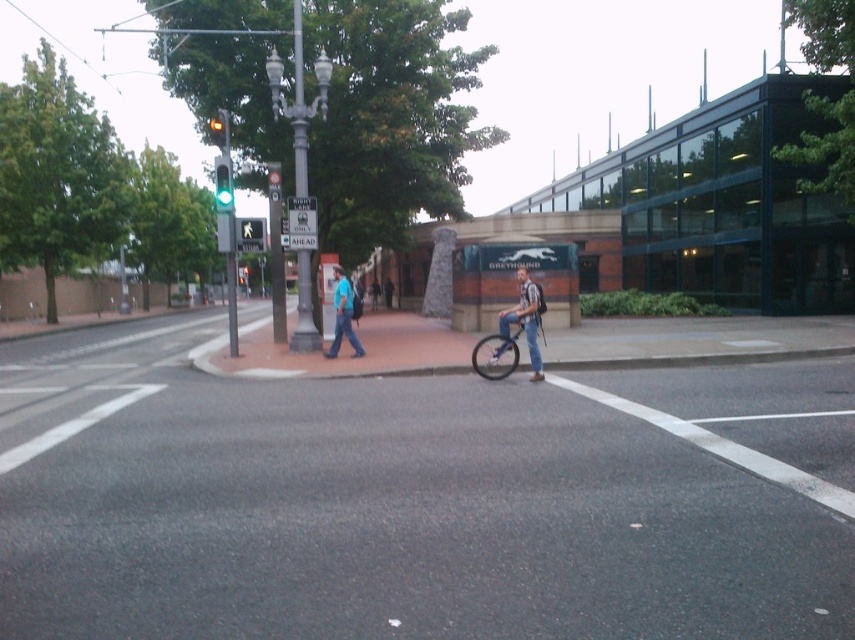
Question: In this image, where is denim jeans at center located relative to green glass traffic light at upper center?

Choices:
 (A) left
 (B) right

Answer: (B)

Question: Where is blue fabric shirt at center located in relation to black plastic pedestrian crossing at center in the image?

Choices:
 (A) left
 (B) right

Answer: (B)

Question: Among these points, which one is nearest to the camera?

Choices:
 (A) (220, 131)
 (B) (500, 328)
 (C) (345, 285)
 (D) (228, 204)

Answer: (B)

Question: Estimate the real-world distances between objects in this image. Which object is closer to the white plastic pedestrian crossing sign at center?

Choices:
 (A) green glass traffic light at upper center
 (B) green glass traffic light at upper left

Answer: (A)

Question: Can you confirm if metallic silver bicycle at center is positioned above blue fabric shirt at center?

Choices:
 (A) yes
 (B) no

Answer: (B)

Question: Which of these objects is positioned farthest from the green glass traffic light at upper left?

Choices:
 (A) green glass traffic light at upper center
 (B) metallic silver bicycle at center
 (C) denim jeans at center

Answer: (C)